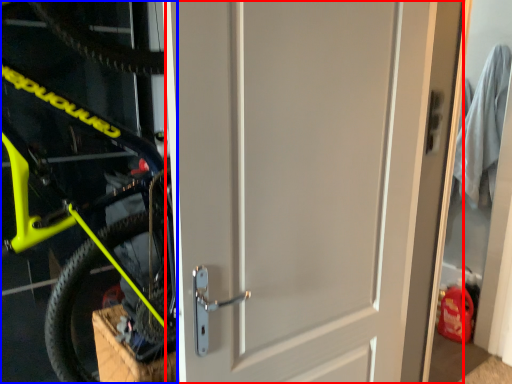
Question: Which object appears closest to the camera in this image, door (highlighted by a red box) or bicycle (highlighted by a blue box)?

Choices:
 (A) door
 (B) bicycle

Answer: (B)